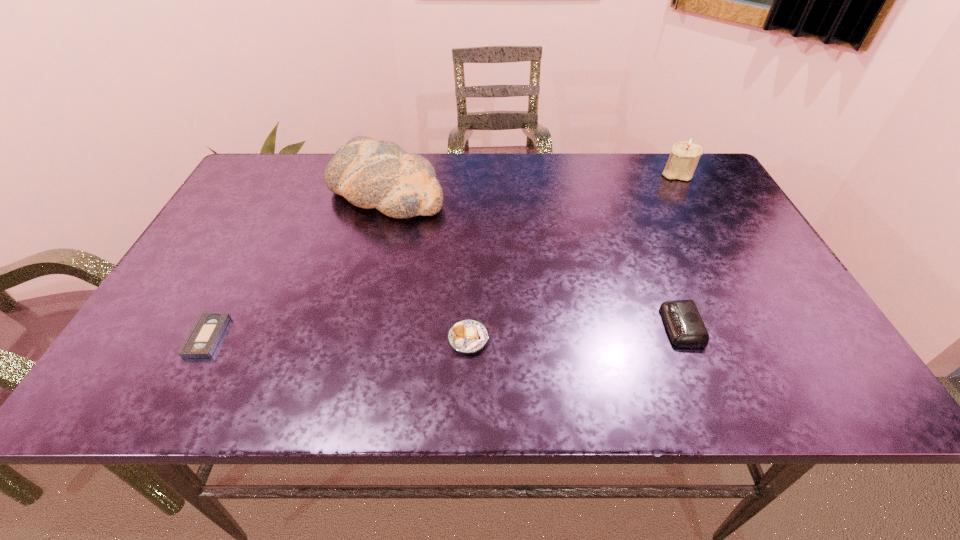
The width and height of the screenshot is (960, 540). I want to click on vacant space that satisfies the following two spatial constraints: 1. on the back side of the videotape; 2. on the right side of the candle_holder, so click(x=294, y=173).